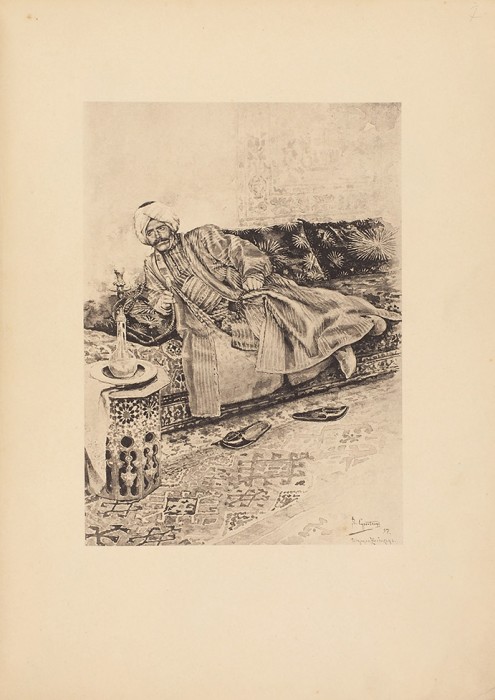
I want to click on hookah base left center, so click(x=125, y=363), click(x=123, y=335).